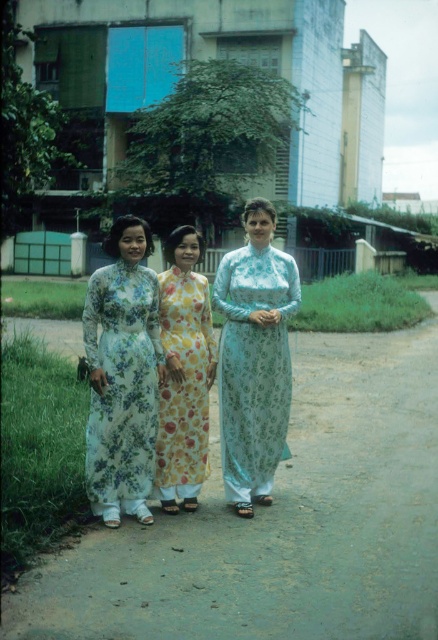
You are standing on the paved path where the three women are standing. You see two points marked in the image. Which point, point [96,282] or point [186,376], is closer to you?

Point [96,282] is closer to the viewer than point [186,376].

Consider the image. You are a photographer setting up a tripod on the smooth concrete path at center. You need to place the tripod so that it doesn not block the view of the floral silk ao dai at center. Based on the scene description, can you determine if the path is wide enough to accommodate the tripod without obstructing the ao dai?

The smooth concrete path at center might be wider than floral silk ao dai at center. Since the path could be wider, there is a possibility that the tripod can be placed on the path without blocking the view of the floral silk ao dai at center. However, the exact dimensions are uncertain, so careful positioning is recommended.

You are a photographer planning to take a picture of the three women wearing the floral silk ao dai at center. You want to ensure the smooth concrete path at center is visible in the background. Since the path is positioned relative to the ao dai, where should you place the ao dai in your camera frame to include the path?

The smooth concrete path at center is on the right side of the floral silk ao dai at center, so to include the path in the background, position the floral silk ao dai at center to the left side of your camera frame. This will allow the path to appear on the right side of the frame.